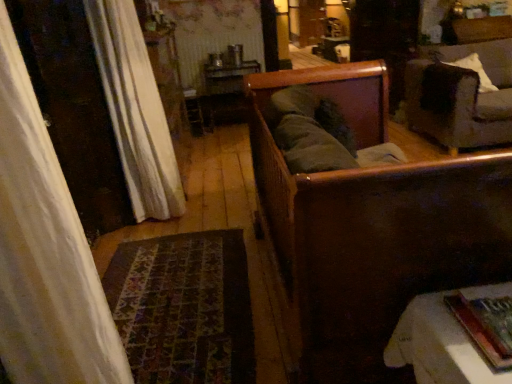
Question: Which direction should I rotate to look at wooden sofa at center, the 1th furniture positioned from the front?

Choices:
 (A) right
 (B) left

Answer: (A)

Question: Considering the relative sizes of white textured curtain at left and white soft pillow at upper right in the image provided, is white textured curtain at left shorter than white soft pillow at upper right?

Choices:
 (A) yes
 (B) no

Answer: (B)

Question: Can you confirm if white textured curtain at left is positioned to the right of white soft pillow at upper right?

Choices:
 (A) yes
 (B) no

Answer: (B)

Question: Is white textured curtain at left taller than white soft pillow at upper right?

Choices:
 (A) no
 (B) yes

Answer: (B)

Question: Considering the relative sizes of white textured curtain at left and white soft pillow at upper right in the image provided, is white textured curtain at left smaller than white soft pillow at upper right?

Choices:
 (A) yes
 (B) no

Answer: (B)

Question: Is white textured curtain at left outside of white soft pillow at upper right?

Choices:
 (A) no
 (B) yes

Answer: (B)

Question: From a real-world perspective, is white textured curtain at left below white soft pillow at upper right?

Choices:
 (A) no
 (B) yes

Answer: (B)

Question: Is wooden sofa at center, the 1th furniture positioned from the front, positioned far away from white textured curtain at left?

Choices:
 (A) no
 (B) yes

Answer: (A)

Question: Is wooden sofa at center, the 1th furniture positioned from the front, placed right next to white textured curtain at left?

Choices:
 (A) no
 (B) yes

Answer: (A)

Question: Is wooden sofa at center, the 1th furniture positioned from the front, located outside white textured curtain at left?

Choices:
 (A) yes
 (B) no

Answer: (A)

Question: Considering the relative sizes of wooden sofa at center, the 1th furniture positioned from the front, and white textured curtain at left in the image provided, is wooden sofa at center, the 1th furniture positioned from the front, taller than white textured curtain at left?

Choices:
 (A) no
 (B) yes

Answer: (A)

Question: Is wooden sofa at center, positioned as the second furniture in back-to-front order, behind white textured curtain at left?

Choices:
 (A) no
 (B) yes

Answer: (A)

Question: From a real-world perspective, does wooden sofa at center, positioned as the second furniture in back-to-front order, sit lower than white textured curtain at left?

Choices:
 (A) yes
 (B) no

Answer: (A)

Question: From the image's perspective, is wooden sofa at center, positioned as the second furniture in back-to-front order, above dark gray fabric couch at upper right?

Choices:
 (A) yes
 (B) no

Answer: (B)